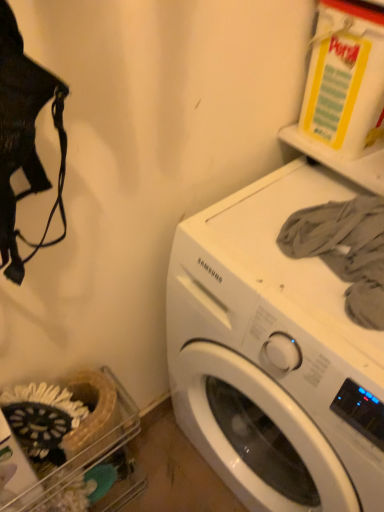
At what (x,y) coordinates should I click in order to perform the action: click on free space to the left of gray cotton shirt at upper right. Please return your answer as a coordinate pair (x, y). Looking at the image, I should click on (244, 245).